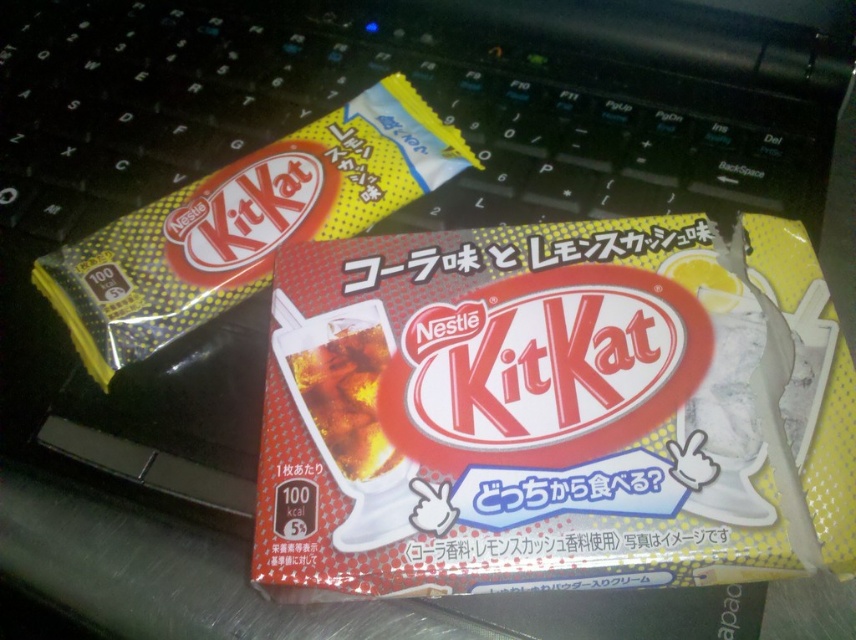
You are organizing items on a desk and need to place a matte plastic kitkat at center and a translucent plastic soda at center. According to the image, which item is positioned to the left?

The translucent plastic soda at center is positioned to the left of the matte plastic kitkat at center.

You are trying to place a small sticker on the laptop keyboard where the packages are not covering it. Given the positions of the packages marked as point 1 at point (569, 225) and point 2 at point (440, 172), which point should you choose to ensure the sticker is placed on an uncovered area?

You should choose point 2 at (440, 172) because point 1 at (569, 225) is in front of point 2, meaning the area at point 1 is covered by the package, while point 2 is behind and likely uncovered.